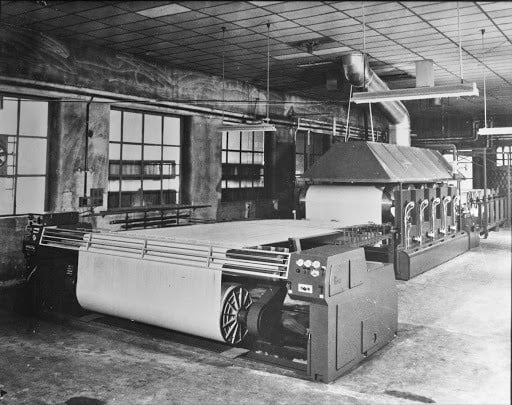
The height and width of the screenshot is (405, 512). What are the coordinates of `light` in the screenshot? It's located at (404, 98), (243, 129), (485, 128).